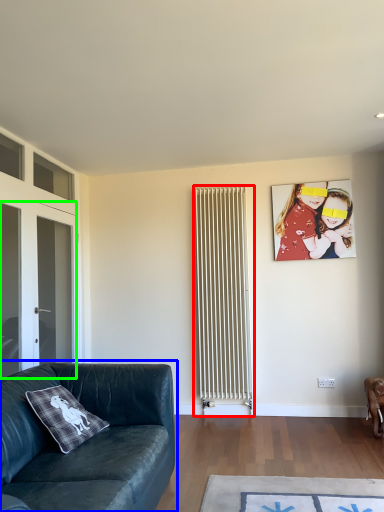
Question: Considering the real-world distances, which object is closest to radiator (highlighted by a red box)? studio couch (highlighted by a blue box) or glass door (highlighted by a green box).

Choices:
 (A) studio couch
 (B) glass door

Answer: (B)